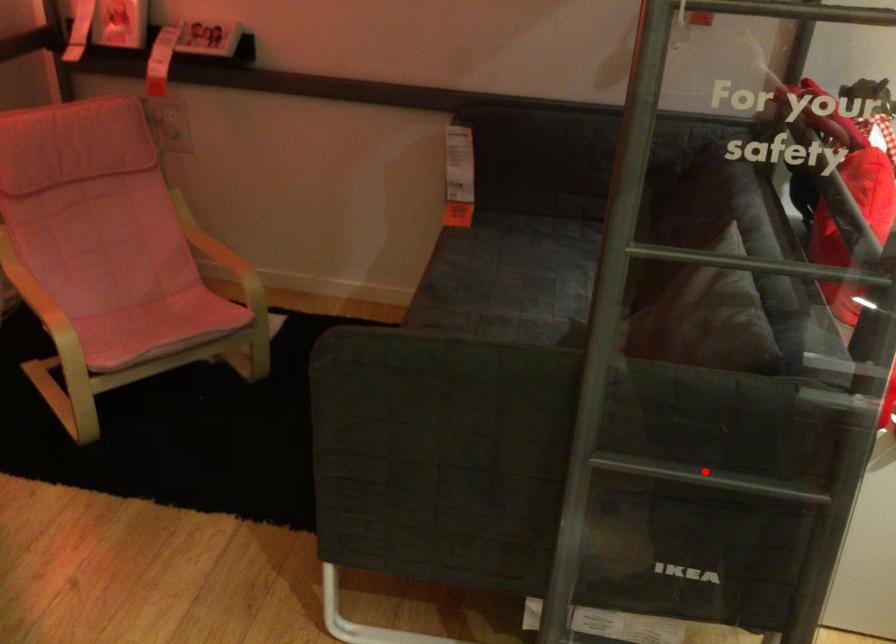
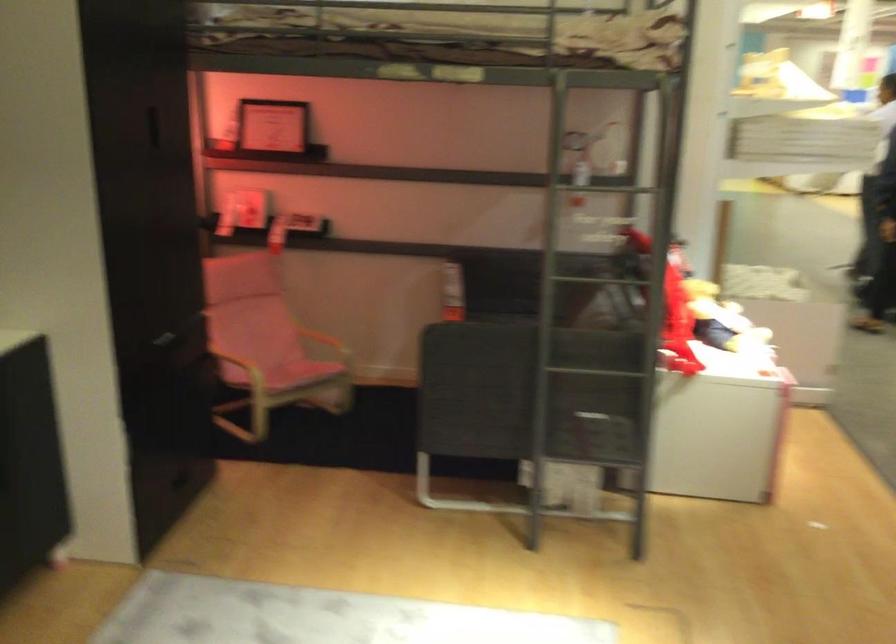
Locate, in the second image, the point that corresponds to the highlighted location in the first image.

(610, 374)